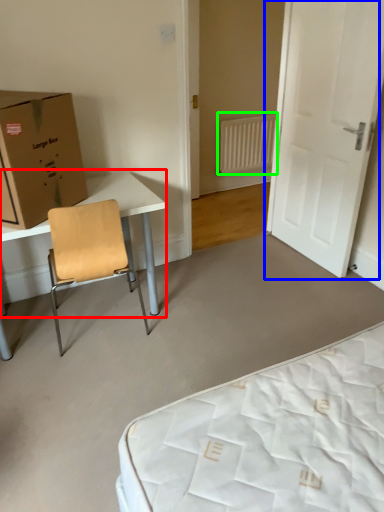
Question: Which is farther away from table (highlighted by a red box)? door (highlighted by a blue box) or radiator (highlighted by a green box)?

Choices:
 (A) door
 (B) radiator

Answer: (B)